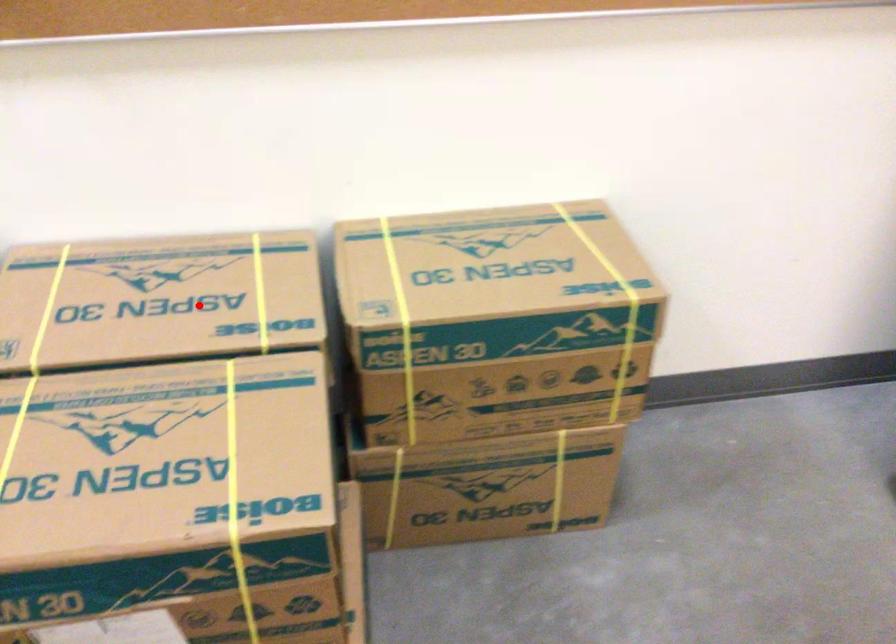
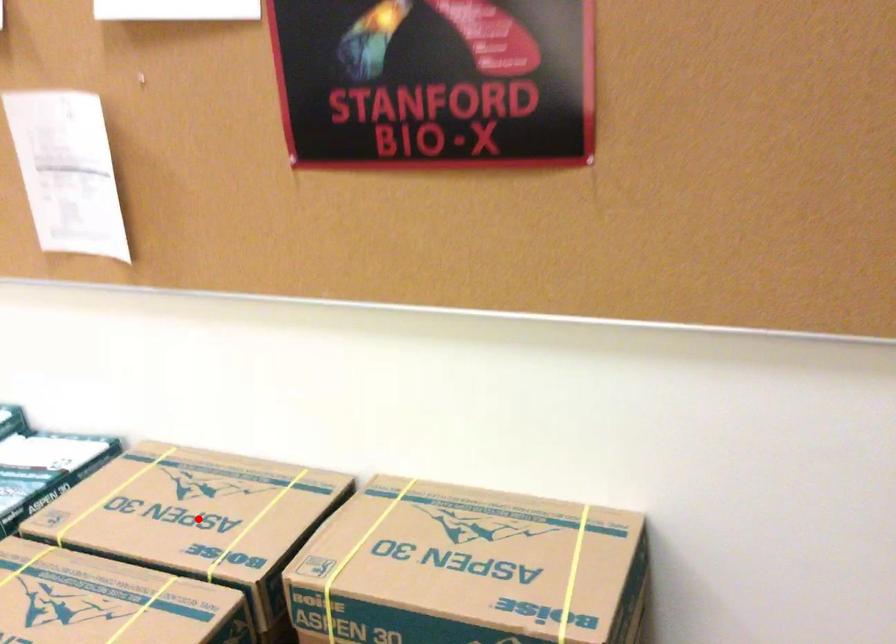
I am providing you with two images of the same scene from different viewpoints. A red point is marked on the first image and another point is marked on the second image. Do the highlighted points in image1 and image2 indicate the same real-world spot?

Yes